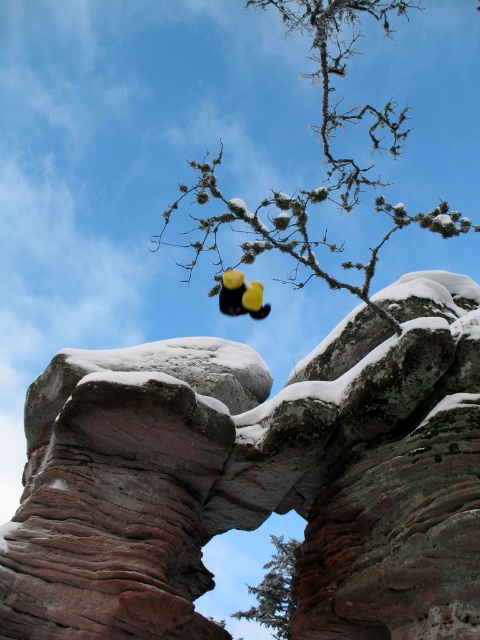
Question: Can you confirm if rustic stone arch at center is thinner than green textured tree at center?

Choices:
 (A) yes
 (B) no

Answer: (B)

Question: Which is nearer to the rustic stone arch at center?

Choices:
 (A) snow-covered branches at center
 (B) green textured tree at center
 (C) yellow matte duck at center

Answer: (B)

Question: Which object is closer to the camera taking this photo?

Choices:
 (A) snow-covered branches at center
 (B) yellow matte duck at center
 (C) green textured tree at center

Answer: (A)

Question: Does green textured tree at center have a lesser width compared to yellow matte duck at center?

Choices:
 (A) no
 (B) yes

Answer: (A)

Question: Is the position of snow-covered branches at center less distant than that of green textured tree at center?

Choices:
 (A) no
 (B) yes

Answer: (B)

Question: Based on their relative distances, which object is nearer to the rustic stone arch at center?

Choices:
 (A) green textured tree at center
 (B) snow-covered branches at center
 (C) yellow matte duck at center

Answer: (A)